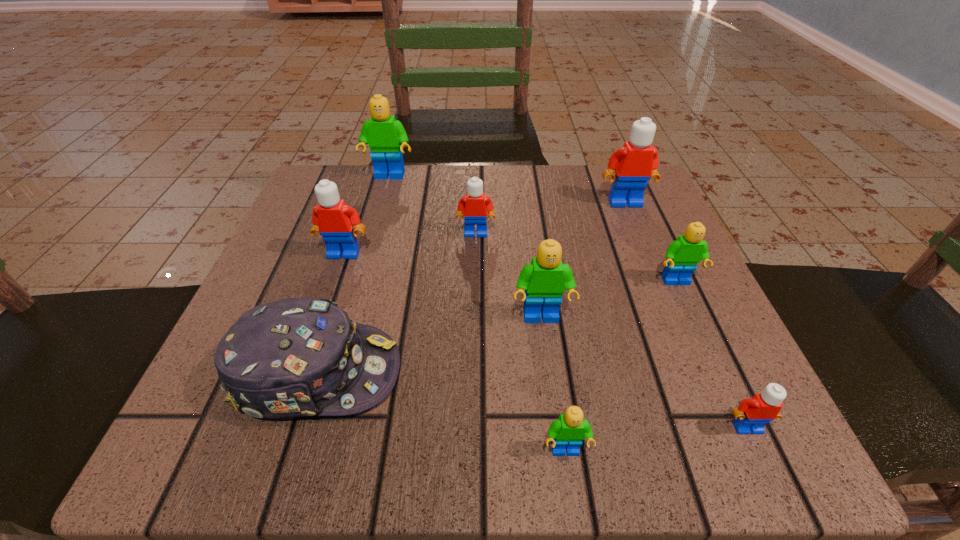
Where is `vacant region between the smallest green Lego and the fourth farthest Lego`? vacant region between the smallest green Lego and the fourth farthest Lego is located at coordinates (455, 352).

Locate an element on the screen. This screenshot has width=960, height=540. vacant area between the farthest object and the nearest object is located at coordinates (477, 314).

I want to click on unoccupied area between the second nearest Lego and the rightmost green Lego, so click(711, 355).

Locate an element on the screen. This screenshot has height=540, width=960. free space that is in between the farthest object and the nearest object is located at coordinates (477, 314).

Identify the location of vacant area between the leftmost white Lego and the nearest object. This screenshot has width=960, height=540. (455, 352).

I want to click on free spot between the fourth nearest Lego and the leftmost white Lego, so click(510, 268).

At what (x,y) coordinates should I click in order to perform the action: click on object that stands as the fourth closest to the sixth farthest Lego. Please return your answer as a coordinate pair (x, y). Image resolution: width=960 pixels, height=540 pixels. Looking at the image, I should click on (475, 207).

Select which object is the fourth closest to the nearest white Lego. Please provide its 2D coordinates. Your answer should be formatted as a tuple, i.e. [(x, y)], where the tuple contains the x and y coordinates of a point satisfying the conditions above.

[(299, 357)]

Choose which Lego is the fourth nearest neighbor to the fifth farthest object. Please provide its 2D coordinates. Your answer should be formatted as a tuple, i.e. [(x, y)], where the tuple contains the x and y coordinates of a point satisfying the conditions above.

[(475, 207)]

Where is `Lego that can be found as the sixth closest to the headwear`? This screenshot has width=960, height=540. Lego that can be found as the sixth closest to the headwear is located at coordinates (682, 255).